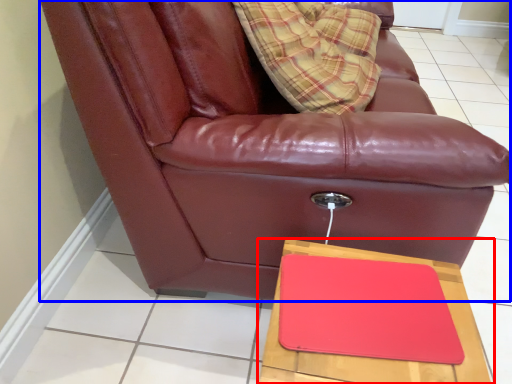
Question: Among these objects, which one is nearest to the camera, table (highlighted by a red box) or chair (highlighted by a blue box)?

Choices:
 (A) table
 (B) chair

Answer: (A)